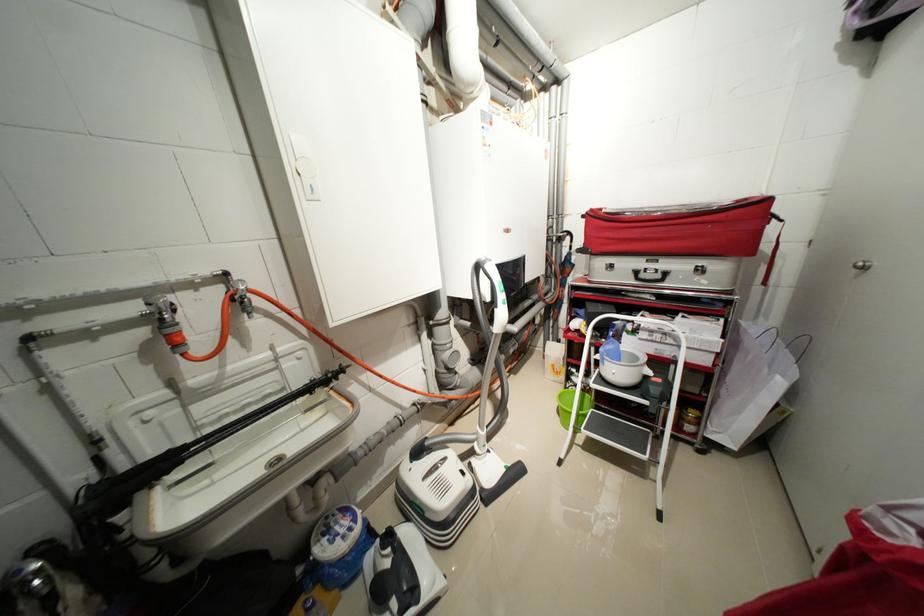
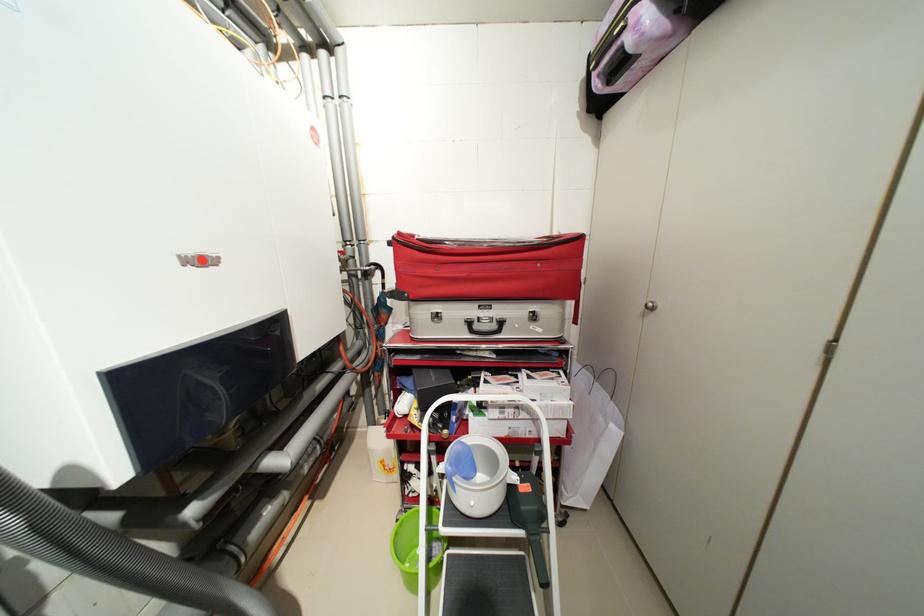
Locate, in the second image, the point that corresponds to (x=611, y=360) in the first image.

(459, 485)